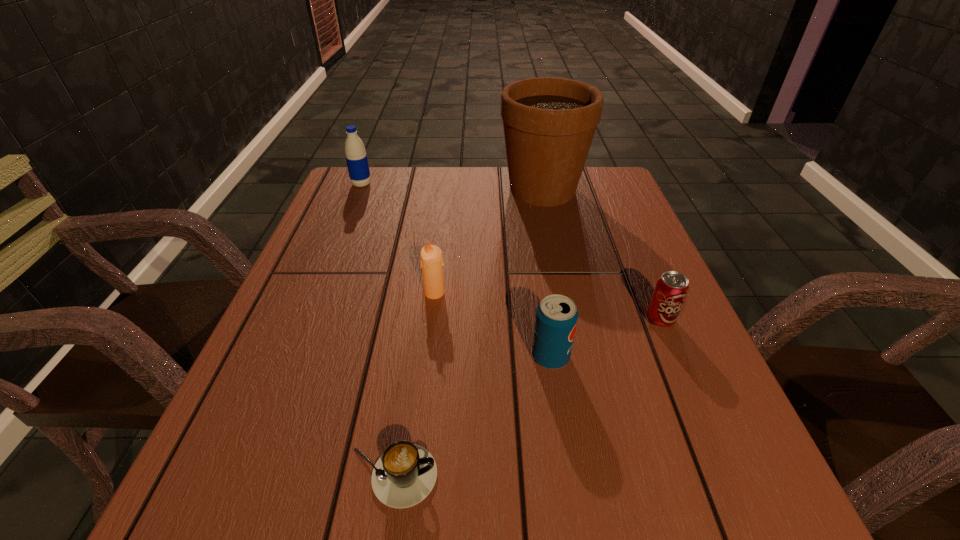
Locate an element on the screen. This screenshot has width=960, height=540. flowerpot present at the right edge is located at coordinates (549, 123).

This screenshot has width=960, height=540. Find the location of `soda present at the right edge`. soda present at the right edge is located at coordinates (670, 292).

Image resolution: width=960 pixels, height=540 pixels. Find the location of `object that is positioned at the far left corner`. object that is positioned at the far left corner is located at coordinates (355, 153).

The image size is (960, 540). I want to click on object that is at the far right corner, so click(x=549, y=123).

I want to click on vacant space at the far edge of the desktop, so click(x=485, y=202).

Image resolution: width=960 pixels, height=540 pixels. Identify the location of free space at the near edge. (345, 538).

Locate an element on the screen. The width and height of the screenshot is (960, 540). vacant area at the left edge is located at coordinates (241, 418).

You are a GUI agent. You are given a task and a screenshot of the screen. Output one action in this format:
    pyautogui.click(x=<x>, y=<y>)
    Task: Click on the vacant space at the right edge of the desktop
    
    Given the screenshot: What is the action you would take?
    pyautogui.click(x=616, y=234)

This screenshot has height=540, width=960. Find the location of `vacant space at the near left corner of the desktop`. vacant space at the near left corner of the desktop is located at coordinates (263, 493).

The width and height of the screenshot is (960, 540). In the image, there is a desktop. In order to click on vacant space at the far right corner in this screenshot , I will do `click(578, 208)`.